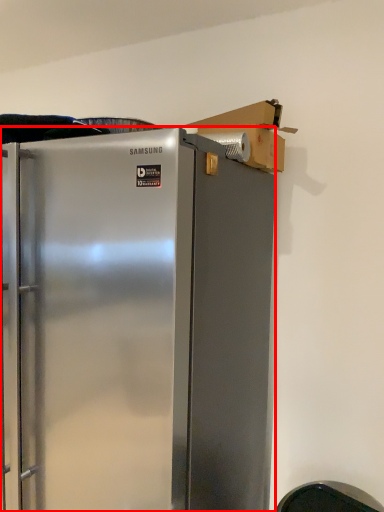
Question: Where is refrigerator (annotated by the red box) located in relation to cardboard box in the image?

Choices:
 (A) right
 (B) left

Answer: (B)